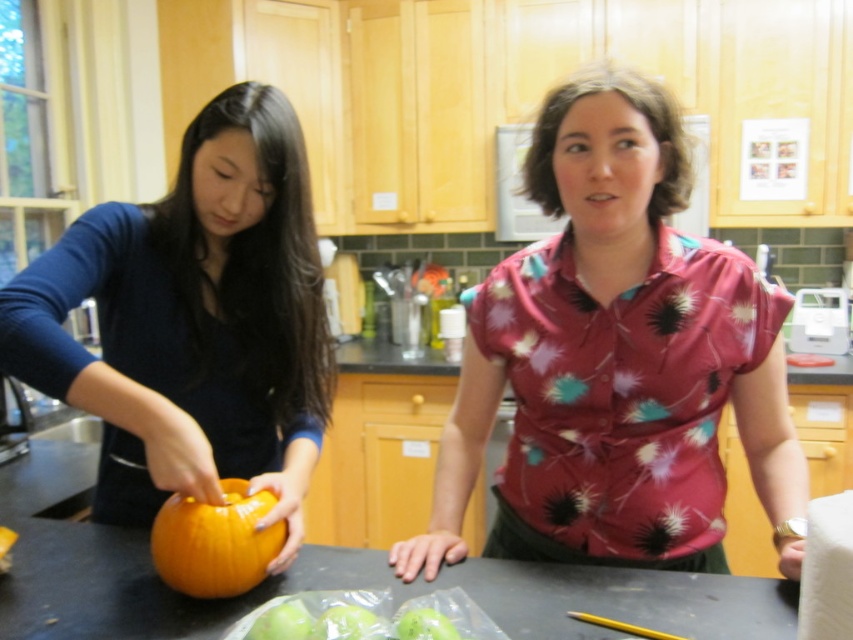
Between green matte apple at lower center and green matte apple at center, which one is positioned higher?

green matte apple at center is above.

Find the location of a particular element. Image resolution: width=853 pixels, height=640 pixels. green matte apple at lower center is located at coordinates (282, 621).

Is matte orange pumpkin at center to the left of green matte apple at center from the viewer's perspective?

Indeed, matte orange pumpkin at center is positioned on the left side of green matte apple at center.

Between matte orange pumpkin at center and green matte apple at center, which one appears on the right side from the viewer's perspective?

green matte apple at center is more to the right.

Between point (146, 328) and point (432, 616), which one is positioned behind?

Point (146, 328)

I want to click on matte orange pumpkin at center, so click(x=192, y=321).

Is smooth orange pumpkin at center behind green matte apple at center?

Yes.

Who is lower down, smooth orange pumpkin at center or green matte apple at center?

smooth orange pumpkin at center is lower down.

Between point (325, 557) and point (430, 628), which one is positioned in front?

Point (430, 628)

Image resolution: width=853 pixels, height=640 pixels. I want to click on smooth orange pumpkin at center, so click(x=363, y=588).